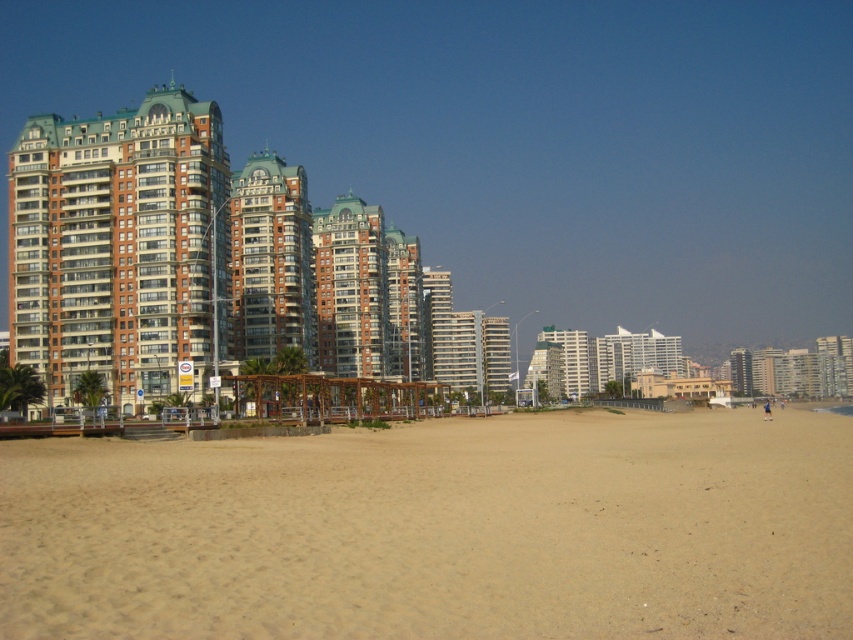
Measure the distance from brown sandy beach at lower center to brick textured building at left.

The distance of brown sandy beach at lower center from brick textured building at left is 166.13 feet.

Identify the location of brown sandy beach at lower center. (438, 531).

Which is behind, point (199, 444) or point (96, 150)?

The point (96, 150) is behind.

Find the location of a particular element. This screenshot has height=640, width=853. brown sandy beach at lower center is located at coordinates (438, 531).

Consider the image. Can you confirm if brick textured building at left is positioned to the right of brown brick building at left?

Correct, you'll find brick textured building at left to the right of brown brick building at left.

Who is more distant from viewer, (39, 262) or (117, 257)?

The point (39, 262) is more distant.

Identify the location of brick textured building at left. coord(152,252).

Consider the image. Between brown sandy beach at lower center and brown brick building at left, which one is positioned lower?

brown sandy beach at lower center is lower down.

Where is `brown sandy beach at lower center`? brown sandy beach at lower center is located at coordinates (438, 531).

Is point (201, 448) farther from viewer compared to point (59, 376)?

No, (201, 448) is closer to viewer.

Identify the location of brown sandy beach at lower center. (438, 531).